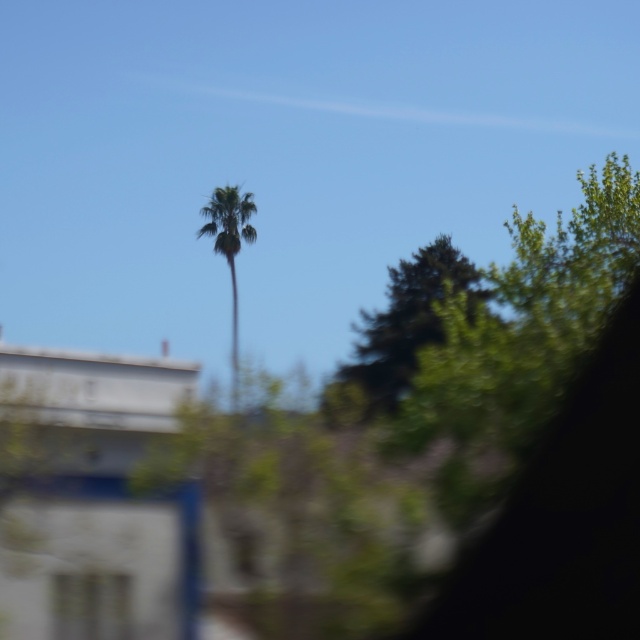
Question: Which object is closer to the camera taking this photo?

Choices:
 (A) transparent glass car window at lower left
 (B) green leafy tree at center

Answer: (A)

Question: Which point appears farthest from the camera in this image?

Choices:
 (A) (232, 200)
 (B) (376, 316)
 (C) (88, 577)

Answer: (A)

Question: In this image, where is green leafy tree at center located relative to transparent glass car window at lower left?

Choices:
 (A) above
 (B) below

Answer: (A)

Question: Which point appears farthest from the camera in this image?

Choices:
 (A) (364, 387)
 (B) (99, 593)

Answer: (A)

Question: Does green leafy tree at center have a lesser width compared to green leafy palm tree at center?

Choices:
 (A) yes
 (B) no

Answer: (A)

Question: Does green leafy tree at center have a smaller size compared to green leafy palm tree at center?

Choices:
 (A) no
 (B) yes

Answer: (B)